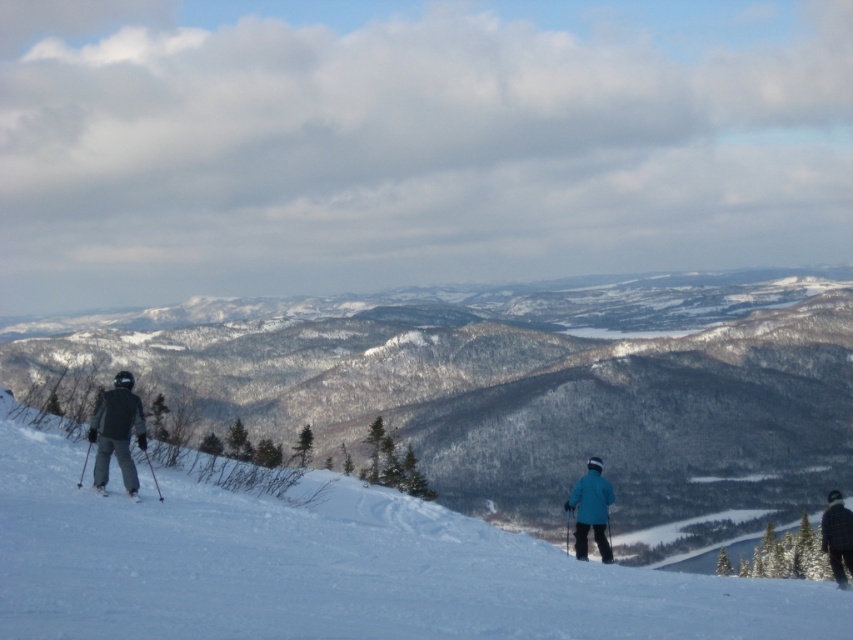
You are a photographer standing on the snowy slope and want to capture a photo of the dark gray ski suit at left and the white matte snow at center. Based on their positions, which object will appear closer to the bottom of the photo?

The dark gray ski suit at left will appear closer to the bottom of the photo because it is shorter than the white matte snow at center, which is taller and thus positioned higher up in the frame.

You are a photographer standing in the winter landscape scene. You want to take a photo of the blue matte jacket at lower center and the white matte snow at center. Which object will appear larger in the photo?

The white matte snow at center will appear larger in the photo because it is taller than the blue matte jacket at lower center.

You are a photographer standing at the bottom of the slope. You want to take a photo of the blue matte jacket at lower center. Which direction should you point your camera to capture it?

The blue matte jacket at lower center is located at point (590, 509), so you should point your camera towards the lower center direction to capture it.